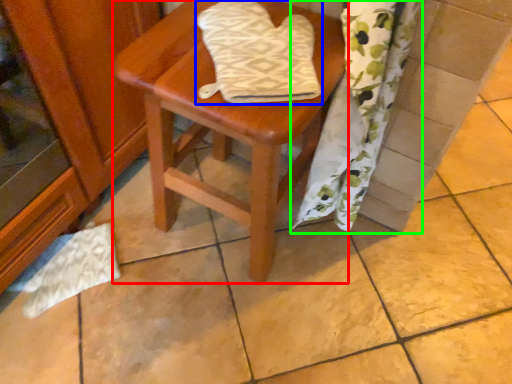
Question: Which is farther away from stool (highlighted by a red box)? beach towel (highlighted by a blue box) or curtain (highlighted by a green box)?

Choices:
 (A) beach towel
 (B) curtain

Answer: (B)